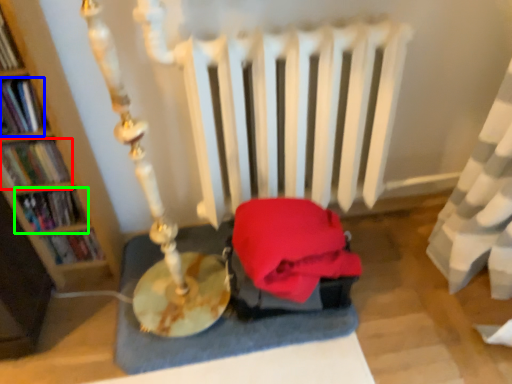
Question: Estimate the real-world distances between objects in this image. Which object is farther from book (highlighted by a red box), book (highlighted by a blue box) or book (highlighted by a green box)?

Choices:
 (A) book
 (B) book

Answer: (A)